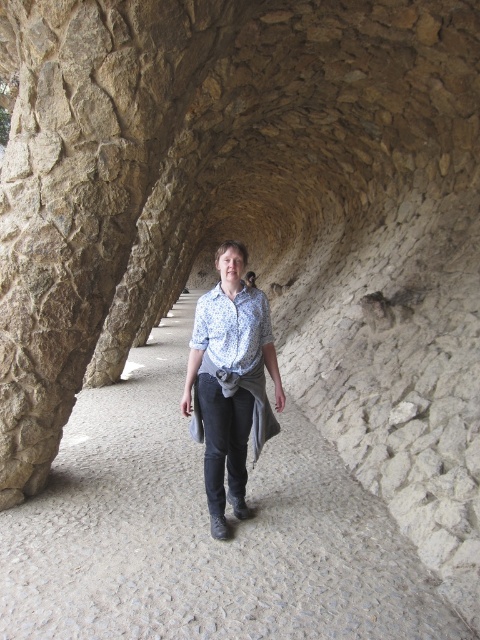
Does printed cotton shirt at center have a lesser height compared to blue printed shirt at center?

No.

Is point (227, 390) positioned before point (243, 292)?

Yes, point (227, 390) is closer to viewer.

You are a GUI agent. You are given a task and a screenshot of the screen. Output one action in this format:
    pyautogui.click(x=<x>, y=<y>)
    Task: Click on the printed cotton shirt at center
    
    Given the screenshot: What is the action you would take?
    pyautogui.click(x=230, y=381)

Between gray cobblestone path at center and blue printed shirt at center, which one is positioned lower?

gray cobblestone path at center is lower down.

Is gray cobblestone path at center bigger than blue printed shirt at center?

No.

What are the coordinates of `gray cobblestone path at center` in the screenshot? It's located at (203, 532).

Can you confirm if gray cobblestone path at center is smaller than printed cotton shirt at center?

Correct, gray cobblestone path at center occupies less space than printed cotton shirt at center.

Is point (303, 544) less distant than point (249, 301)?

That is True.

Is point (356, 561) in front of point (278, 406)?

Yes, point (356, 561) is in front of point (278, 406).

Locate an element on the screen. The height and width of the screenshot is (640, 480). gray cobblestone path at center is located at coordinates (203, 532).